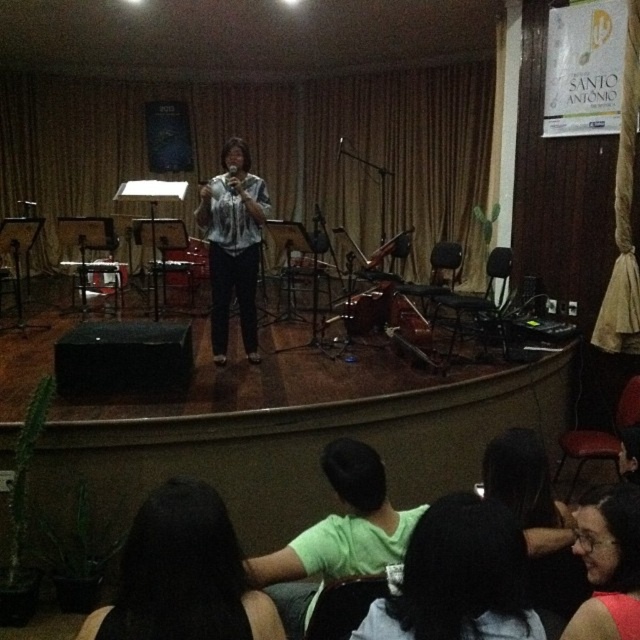
Question: Is green matte shirt at lower center wider than matte black microphone at center?

Choices:
 (A) yes
 (B) no

Answer: (A)

Question: Which object is the farthest from the matte black hair at center?

Choices:
 (A) matte white blouse at center
 (B) black matte shirt at center
 (C) green matte shirt at lower center
 (D) black hair at lower center

Answer: (A)

Question: Among these points, which one is farthest from the camera?

Choices:
 (A) (458, 550)
 (B) (232, 266)

Answer: (B)

Question: Which object is farther from the camera taking this photo?

Choices:
 (A) black hair at lower center
 (B) matte black hair at center

Answer: (B)

Question: Is the position of black hair at lower center more distant than that of green matte shirt at lower center?

Choices:
 (A) yes
 (B) no

Answer: (B)

Question: Does black matte shirt at center appear on the right side of matte black microphone at center?

Choices:
 (A) yes
 (B) no

Answer: (B)